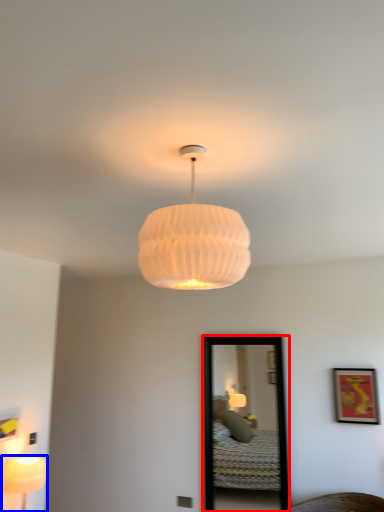
Question: Which object is further to the camera taking this photo, mirror (highlighted by a red box) or lamp (highlighted by a blue box)?

Choices:
 (A) mirror
 (B) lamp

Answer: (A)